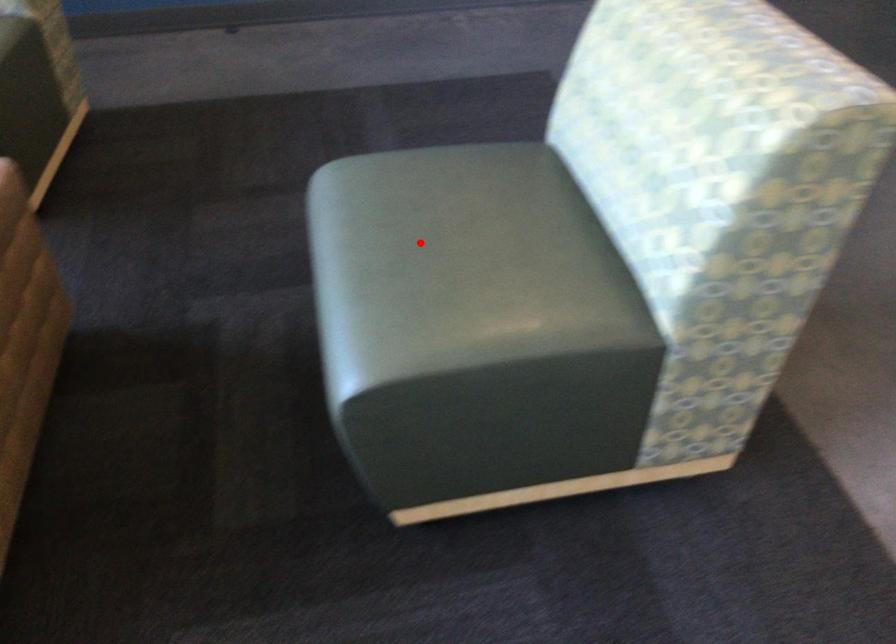
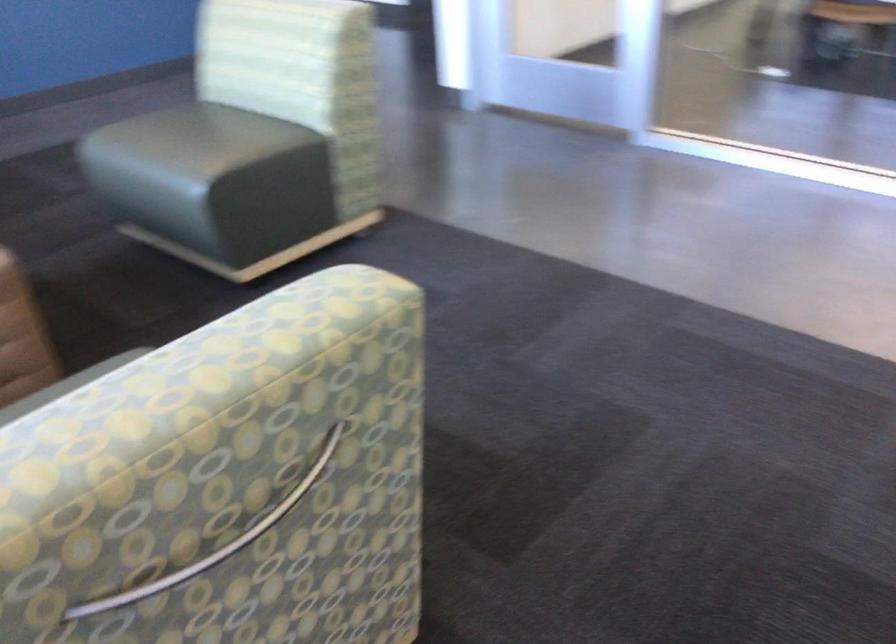
Locate, in the second image, the point that corresponds to the highlighted location in the first image.

(192, 143)